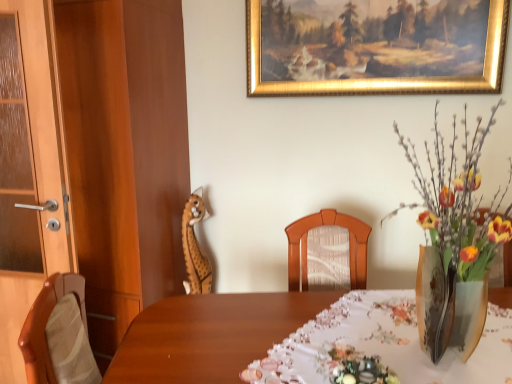
Question: Are wooden door at left and matte wood dresser at left making contact?

Choices:
 (A) yes
 (B) no

Answer: (B)

Question: Can you confirm if wooden door at left is thinner than matte wood dresser at left?

Choices:
 (A) yes
 (B) no

Answer: (A)

Question: Is wooden door at left to the right of matte wood dresser at left from the viewer's perspective?

Choices:
 (A) yes
 (B) no

Answer: (B)

Question: Considering the relative sizes of wooden door at left and matte wood dresser at left in the image provided, is wooden door at left smaller than matte wood dresser at left?

Choices:
 (A) no
 (B) yes

Answer: (B)

Question: From the image's perspective, is wooden door at left on matte wood dresser at left?

Choices:
 (A) yes
 (B) no

Answer: (B)

Question: Could matte wood dresser at left be considered to be inside wooden door at left?

Choices:
 (A) yes
 (B) no

Answer: (B)

Question: Is gold-framed painting at upper center positioned with its back to matte wood dresser at left?

Choices:
 (A) yes
 (B) no

Answer: (B)

Question: Is gold-framed painting at upper center taller than matte wood dresser at left?

Choices:
 (A) yes
 (B) no

Answer: (B)

Question: Is the depth of gold-framed painting at upper center greater than that of matte wood dresser at left?

Choices:
 (A) yes
 (B) no

Answer: (B)

Question: From a real-world perspective, is gold-framed painting at upper center under matte wood dresser at left?

Choices:
 (A) no
 (B) yes

Answer: (A)

Question: From a real-world perspective, does gold-framed painting at upper center stand above matte wood dresser at left?

Choices:
 (A) no
 (B) yes

Answer: (B)

Question: Is gold-framed painting at upper center to the left of matte wood dresser at left from the viewer's perspective?

Choices:
 (A) yes
 (B) no

Answer: (B)

Question: Does translucent glass vase at right come in front of wooden door at left?

Choices:
 (A) yes
 (B) no

Answer: (A)